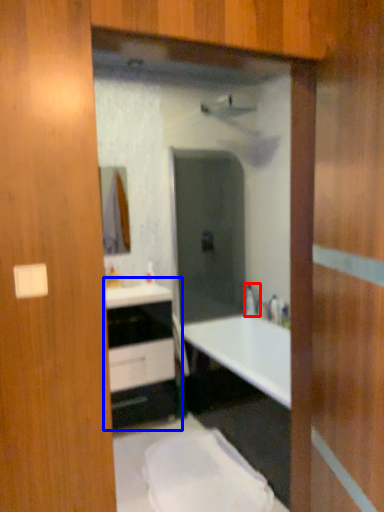
Question: Which point is closer to the camera, faucet (highlighted by a red box) or bathroom cabinet (highlighted by a blue box)?

Choices:
 (A) faucet
 (B) bathroom cabinet

Answer: (B)